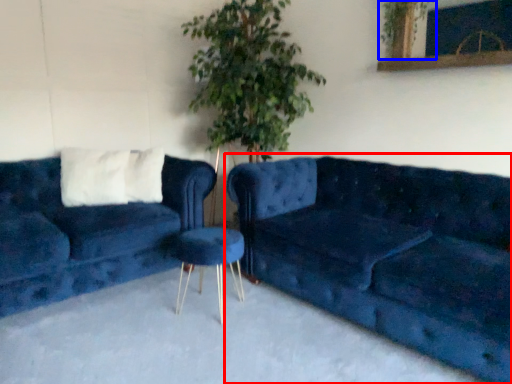
Question: Which object is further to the camera taking this photo, studio couch (highlighted by a red box) or plant (highlighted by a blue box)?

Choices:
 (A) studio couch
 (B) plant

Answer: (B)